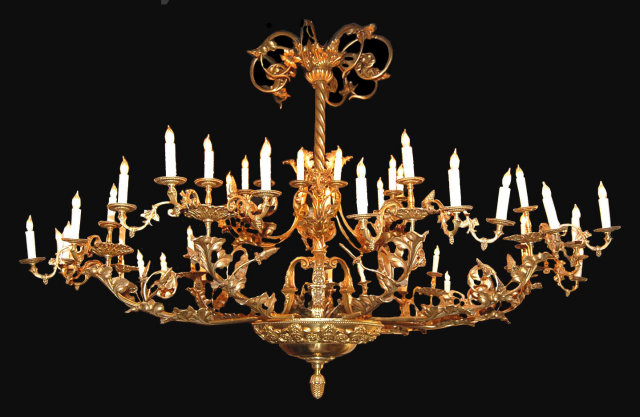
Where is `arm of chandelier`? The height and width of the screenshot is (417, 640). arm of chandelier is located at coordinates (115, 287), (225, 282), (397, 276), (464, 317).